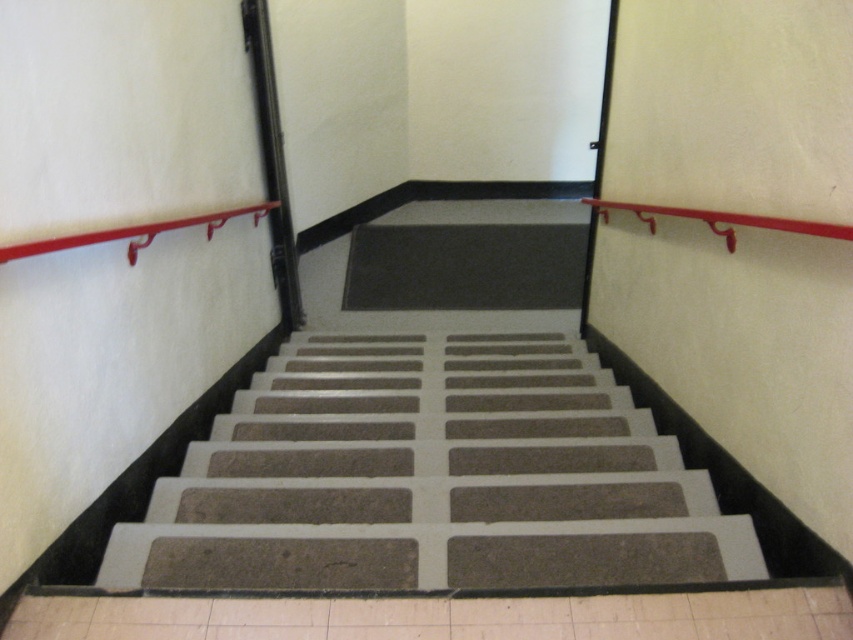
In order to click on matte red handrail at upper left in this screenshot , I will do `click(132, 234)`.

The height and width of the screenshot is (640, 853). I want to click on matte red handrail at upper left, so click(x=132, y=234).

Where is `matte red handrail at upper left`? Image resolution: width=853 pixels, height=640 pixels. matte red handrail at upper left is located at coordinates (132, 234).

Between point (454, 584) and point (109, 241), which one is positioned behind?

Positioned behind is point (109, 241).

Which is behind, point (531, 484) or point (32, 253)?

The point (531, 484) is more distant.

Where is `textured gray carpet at center`? textured gray carpet at center is located at coordinates [431, 490].

Who is positioned more to the right, textured gray carpet at center or metallic red handrail at upper right?

Positioned to the right is metallic red handrail at upper right.

Can you confirm if textured gray carpet at center is wider than metallic red handrail at upper right?

Correct, the width of textured gray carpet at center exceeds that of metallic red handrail at upper right.

What are the coordinates of `textured gray carpet at center` in the screenshot? It's located at (431, 490).